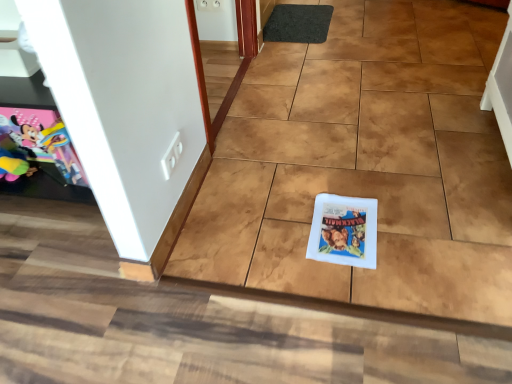
You are a GUI agent. You are given a task and a screenshot of the screen. Output one action in this format:
    pyautogui.click(x=<x>, y=<y>)
    Task: Click on the vacant area that is in front of black rubber doormat at upper center
    This screenshot has height=384, width=512.
    Given the screenshot: What is the action you would take?
    pyautogui.click(x=319, y=53)